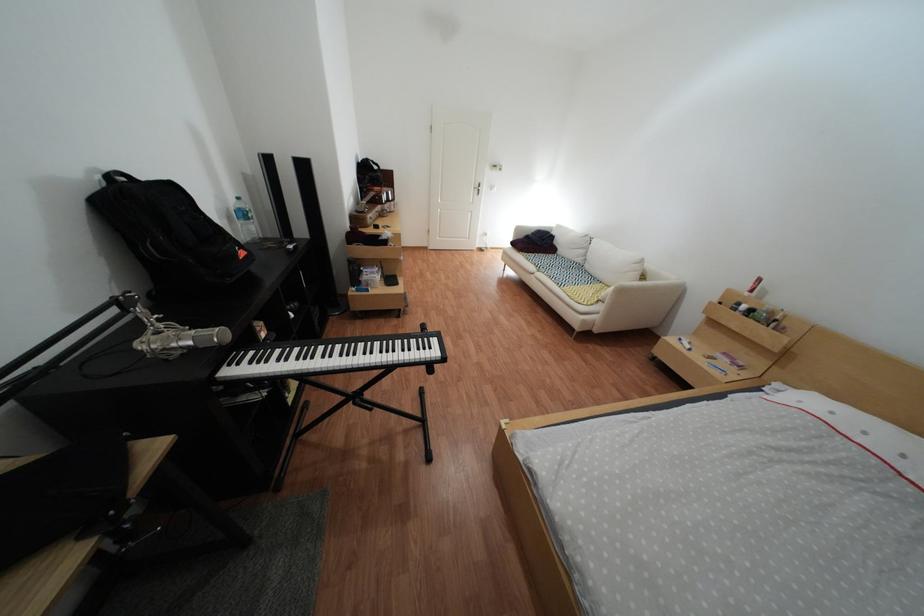
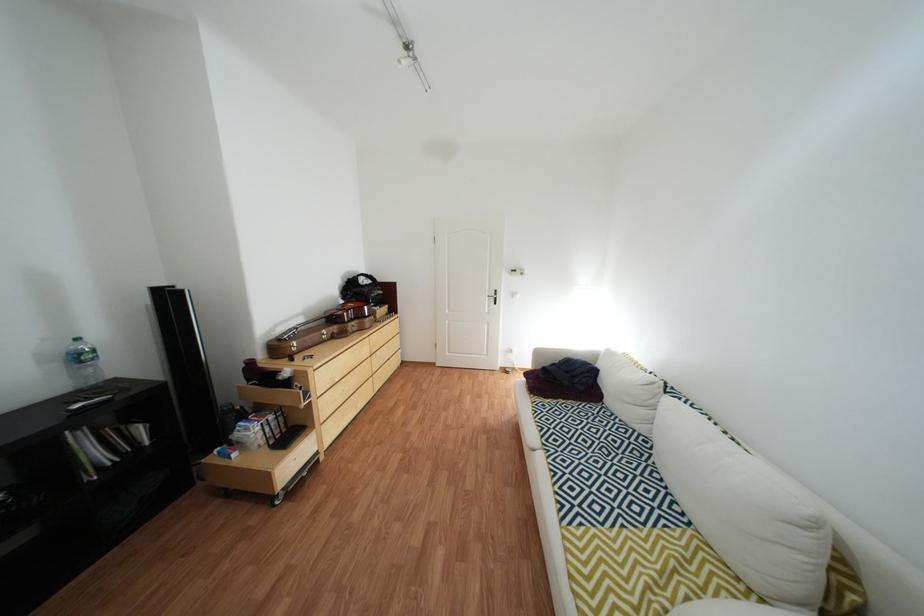
The images are taken continuously from a first-person perspective. In which direction are you moving?

The cameraman walked toward right, forward.